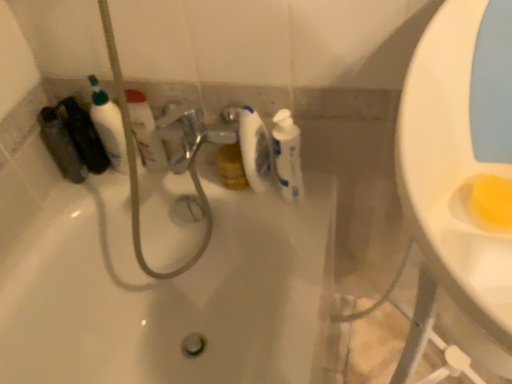
This screenshot has width=512, height=384. Identify the location of vacant space to the right of white glossy bottle at center, marked as the first cleaning product in a right-to-left arrangement. (318, 182).